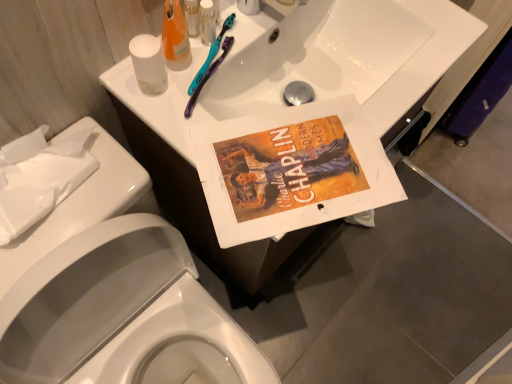
The image size is (512, 384). I want to click on free space in front of clear plastic bottle at upper center, which ranks as the second toiletry in left-to-right order, so click(x=206, y=115).